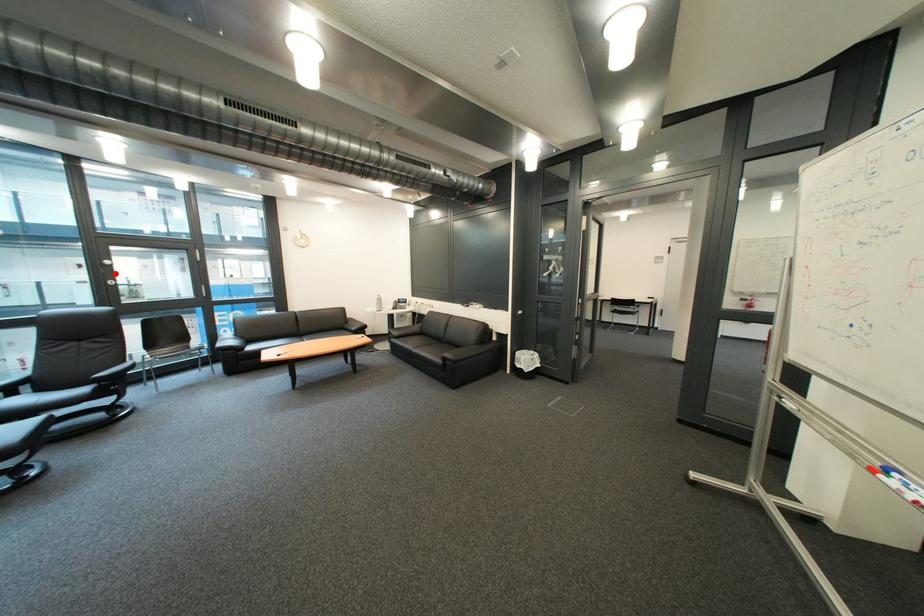
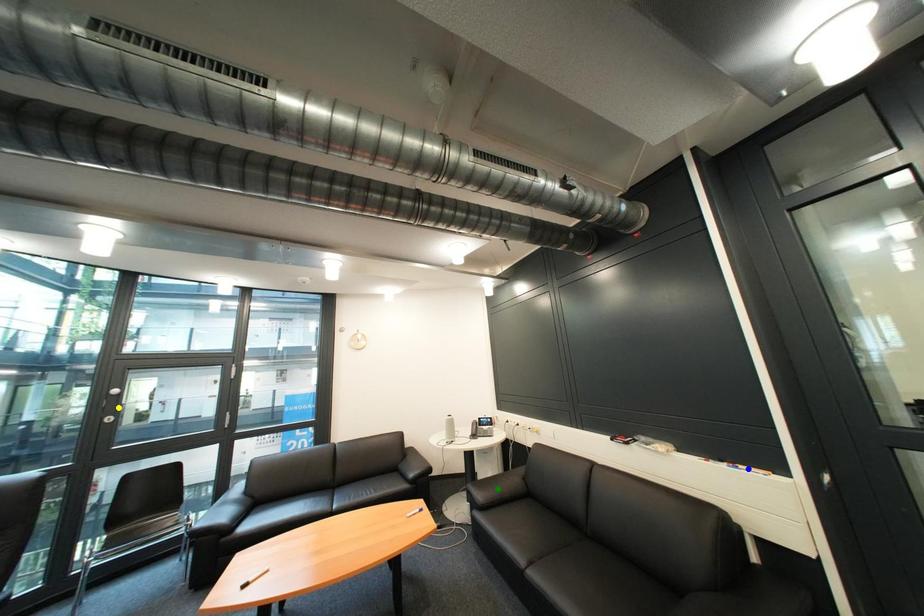
Question: I am providing you with two images of the same scene from different viewpoints. A red point is marked on the first image. You are given multiple points on the second image. Can you choose the point in image 2 that corresponds to the point in image 1?

Choices:
 (A) blue point
 (B) yellow point
 (C) green point

Answer: (B)